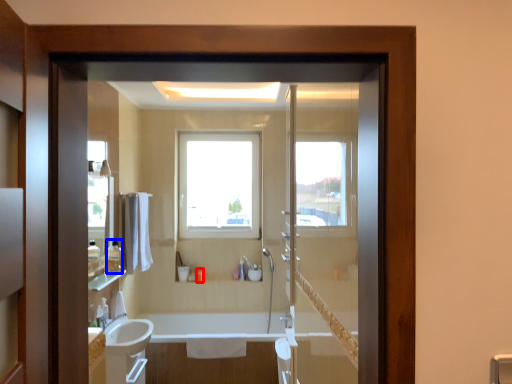
Question: Which object is further to the camera taking this photo, toiletry (highlighted by a red box) or toiletry (highlighted by a blue box)?

Choices:
 (A) toiletry
 (B) toiletry

Answer: (A)